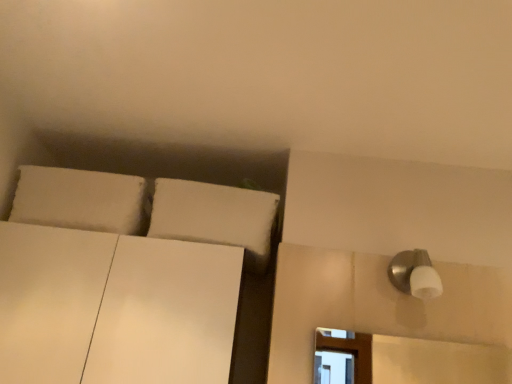
Find the location of `white matte cabinet at left`. white matte cabinet at left is located at coordinates pos(114,308).

The width and height of the screenshot is (512, 384). What do you see at coordinates (114, 308) in the screenshot?
I see `white matte cabinet at left` at bounding box center [114, 308].

Measure the distance between point (x=36, y=290) and camera.

37.28 inches.

Locate an element on the screen. The image size is (512, 384). white matte cabinet at left is located at coordinates (114, 308).